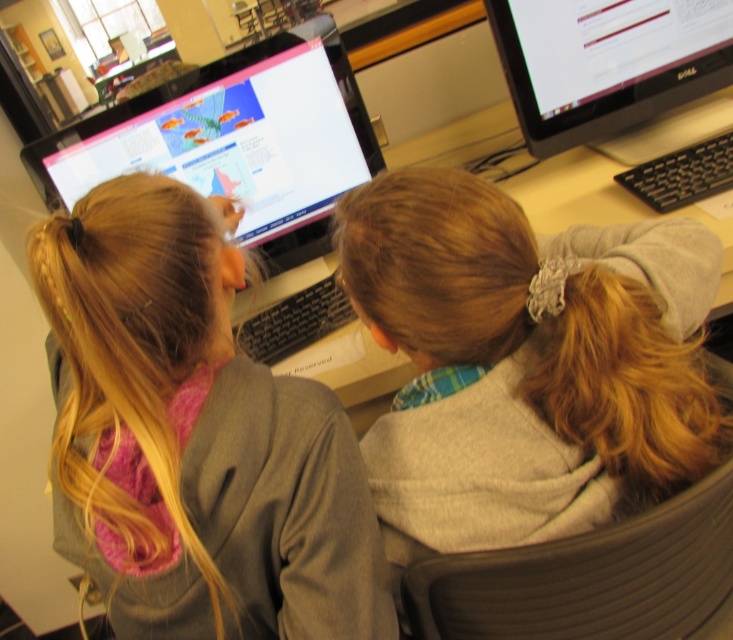
Who is more distant from viewer, (537, 74) or (627, 209)?

The point (537, 74) is more distant.

Is black glossy monitor at upper right to the left of matte plastic computer desk at center from the viewer's perspective?

Yes, black glossy monitor at upper right is to the left of matte plastic computer desk at center.

This screenshot has height=640, width=733. What do you see at coordinates (605, 61) in the screenshot?
I see `black glossy monitor at upper right` at bounding box center [605, 61].

At what (x,y) coordinates should I click in order to perform the action: click on black glossy monitor at upper right. Please return your answer as a coordinate pair (x, y). Looking at the image, I should click on (605, 61).

In the scene shown: Can you confirm if gray sweater at center is taller than black glossy monitor at upper right?

Yes, gray sweater at center is taller than black glossy monitor at upper right.

In order to click on gray sweater at center in this screenshot , I will do click(x=194, y=436).

Does point (246, 609) come in front of point (539, 99)?

Yes, it is.

The height and width of the screenshot is (640, 733). I want to click on gray sweater at center, so click(194, 436).

Between gray sweater at center and matte plastic computer desk at center, which one has more height?

Standing taller between the two is gray sweater at center.

Who is positioned more to the left, gray sweater at center or matte plastic computer desk at center?

Positioned to the left is gray sweater at center.

Describe the element at coordinates (194, 436) in the screenshot. I see `gray sweater at center` at that location.

Where is `gray sweater at center`? The height and width of the screenshot is (640, 733). gray sweater at center is located at coordinates click(x=194, y=436).